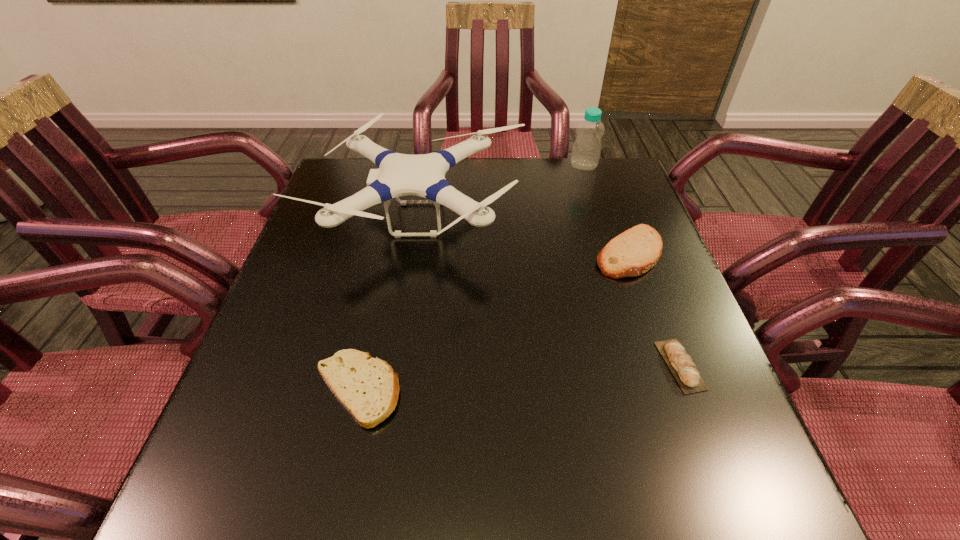
Identify the location of vacant space in between the third shortest object and the bottle. (607, 209).

Find the location of a particular element. This screenshot has height=540, width=960. free space between the leftmost pita bread and the drone is located at coordinates (388, 303).

The image size is (960, 540). I want to click on empty space that is in between the farthest pita bread and the bottle, so click(607, 209).

Image resolution: width=960 pixels, height=540 pixels. I want to click on free space between the leftmost pita bread and the drone, so click(388, 303).

I want to click on free space between the tallest pita bread and the leftmost pita bread, so click(x=493, y=321).

Find the location of a particular element. free space between the tallest pita bread and the drone is located at coordinates (523, 235).

The image size is (960, 540). Find the location of `object that is the closest to the leftmost pita bread`. object that is the closest to the leftmost pita bread is located at coordinates (423, 175).

Where is `object that is the fourth closest to the leftmost pita bread`? object that is the fourth closest to the leftmost pita bread is located at coordinates (586, 150).

Select which pita bread is the third closest to the drone. Please provide its 2D coordinates. Your answer should be formatted as a tuple, i.e. [(x, y)], where the tuple contains the x and y coordinates of a point satisfying the conditions above.

[(684, 370)]

Identify which pita bread is located as the third nearest to the bottle. Please provide its 2D coordinates. Your answer should be formatted as a tuple, i.e. [(x, y)], where the tuple contains the x and y coordinates of a point satisfying the conditions above.

[(368, 388)]